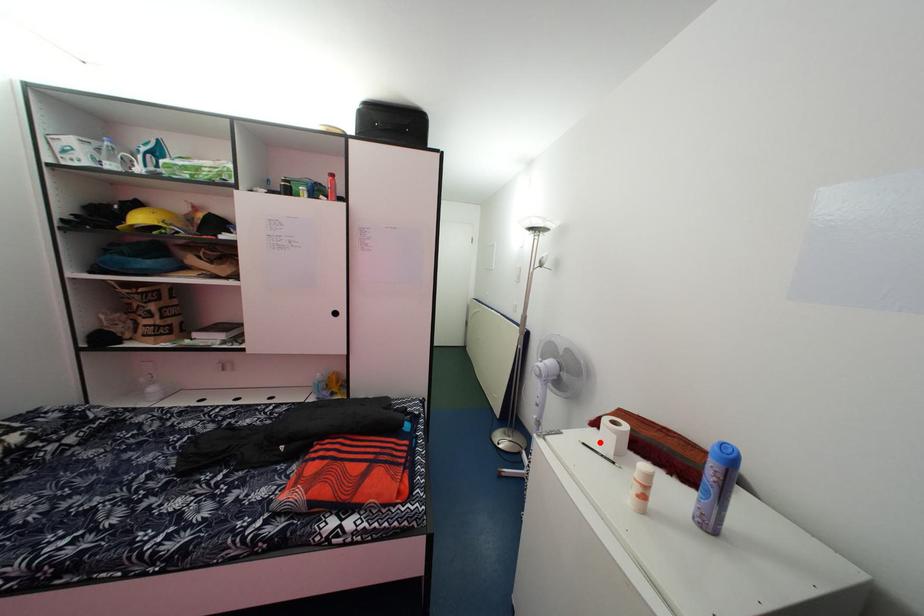
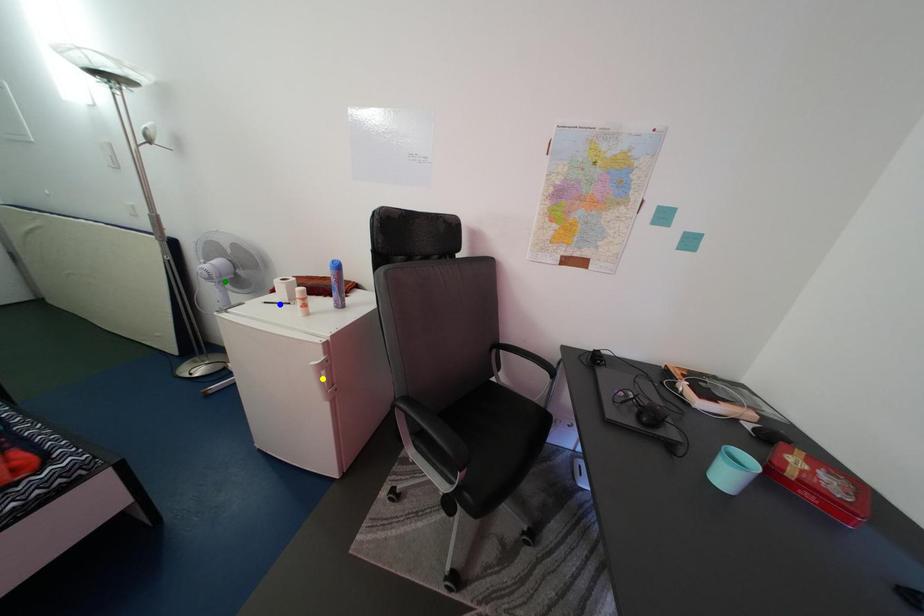
Question: I am providing you with two images of the same scene from different viewpoints. A red point is marked on the first image. You are given multiple points on the second image. Which point in image 2 is actually the same real-world point as the red point in image 1?

Choices:
 (A) blue point
 (B) green point
 (C) yellow point

Answer: (A)